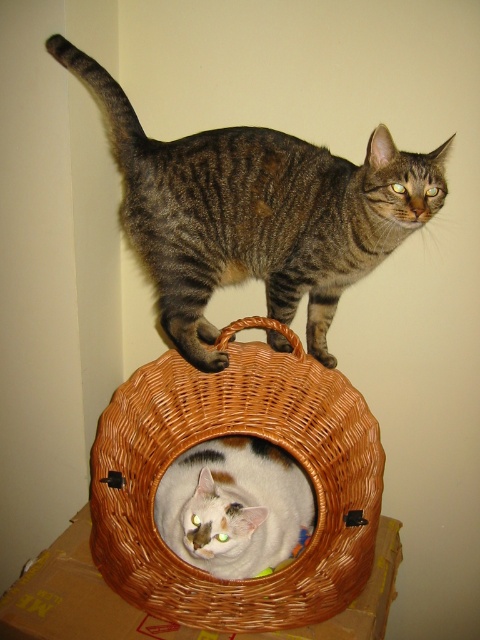
Is woven brown basket at center wider than white fur cat at center?

Indeed, woven brown basket at center has a greater width compared to white fur cat at center.

Can you confirm if woven brown basket at center is positioned below white fur cat at center?

No, woven brown basket at center is not below white fur cat at center.

Who is more distant from viewer, (123, 486) or (176, 531)?

Positioned behind is point (123, 486).

Where is `woven brown basket at center`? The width and height of the screenshot is (480, 640). woven brown basket at center is located at coordinates (241, 433).

Does tabby fur cat at upper center come behind woven brown basket at center?

Yes.

Which is in front, point (131, 225) or point (157, 538)?

Point (157, 538) is more forward.

The image size is (480, 640). What are the coordinates of `tabby fur cat at upper center` in the screenshot? It's located at (255, 212).

Who is lower down, tabby fur cat at upper center or white fur cat at center?

white fur cat at center

Between tabby fur cat at upper center and white fur cat at center, which one appears on the right side from the viewer's perspective?

white fur cat at center is more to the right.

Does point (110, 104) lie in front of point (219, 550)?

No, it is not.

Image resolution: width=480 pixels, height=640 pixels. I want to click on tabby fur cat at upper center, so click(x=255, y=212).